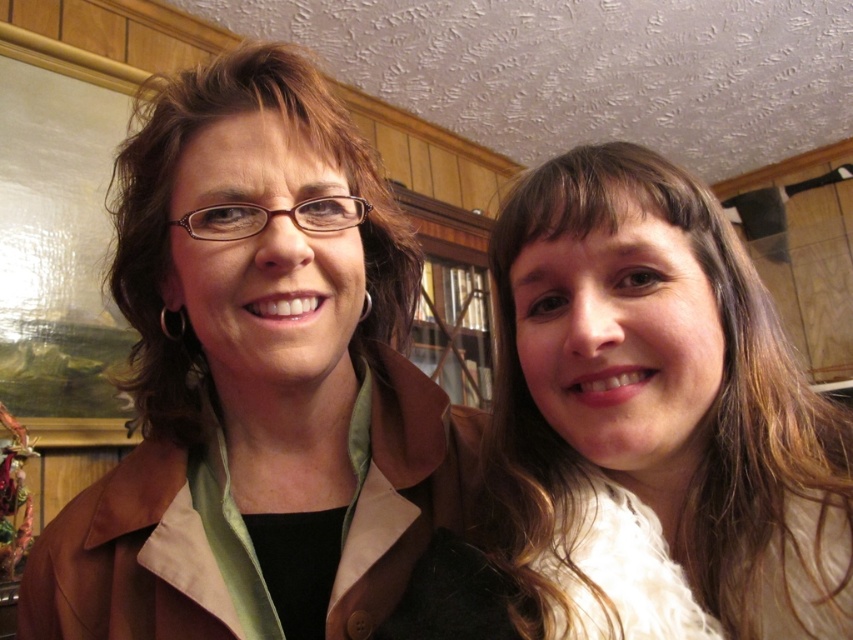
Question: Can you confirm if smooth white blouse at right is smaller than brown matte hair at center?

Choices:
 (A) no
 (B) yes

Answer: (B)

Question: Which object appears closest to the camera in this image?

Choices:
 (A) brown matte hair at center
 (B) matte brown jacket at center

Answer: (B)

Question: Does matte brown jacket at center have a lesser width compared to smooth white blouse at right?

Choices:
 (A) no
 (B) yes

Answer: (A)

Question: Which point appears closest to the camera in this image?

Choices:
 (A) (326, 97)
 (B) (769, 358)

Answer: (B)

Question: Is matte brown jacket at center behind smooth white blouse at right?

Choices:
 (A) yes
 (B) no

Answer: (A)

Question: Which object is positioned closest to the smooth white blouse at right?

Choices:
 (A) matte brown jacket at center
 (B) brown matte hair at center

Answer: (A)